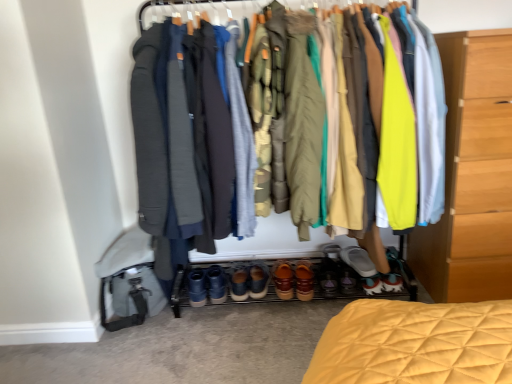
In order to face textured fabric jackets at center, should I rotate leftwards or rightwards?

It's best to rotate right around 2.307 degrees.

What is the approximate width of gray fleece robe at center, acting as the second robe starting from the left?

It is 26.82 inches.

Describe the element at coordinates (307, 278) in the screenshot. The height and width of the screenshot is (384, 512). I see `leather shoes at center, which ranks as the 4th footwear in left-to-right order` at that location.

You are a GUI agent. You are given a task and a screenshot of the screen. Output one action in this format:
    pyautogui.click(x=<x>, y=<y>)
    Task: Click on the textured fabric jackets at center
    
    Given the screenshot: What is the action you would take?
    pyautogui.click(x=267, y=242)

Is leather shoes at center, which ranks as the 4th footwear in left-to-right order, positioned with its back to leather suede shoes at center, placed as the sixth footwear when sorted from right to left?

leather shoes at center, which ranks as the 4th footwear in left-to-right order, does not have its back to leather suede shoes at center, placed as the sixth footwear when sorted from right to left.

From the image's perspective, count 2nd footwears upward from the leather shoes at center, which ranks as the 4th footwear in left-to-right order, and point to it. Please provide its 2D coordinates.

[(239, 284)]

In the scene shown: Is leather shoes at center, which ranks as the 4th footwear in left-to-right order, bigger or smaller than leather suede shoes at center, placed as the sixth footwear when sorted from right to left?

Clearly, leather shoes at center, which ranks as the 4th footwear in left-to-right order, is larger in size than leather suede shoes at center, placed as the sixth footwear when sorted from right to left.

From the picture: From the image's perspective, between leather shoes at center, which ranks as the 4th footwear in left-to-right order, and leather suede shoes at center, which appears as the 1th footwear when viewed from the left, which one is located above?

leather suede shoes at center, which appears as the 1th footwear when viewed from the left, is shown above in the image.

From the image's perspective, is olive green cotton robe at center, the fourth robe from the left, over leather shoes at center, which ranks as the 4th footwear in left-to-right order?

Indeed, from the image's perspective, olive green cotton robe at center, the fourth robe from the left, is shown above leather shoes at center, which ranks as the 4th footwear in left-to-right order.

Is olive green cotton robe at center, the fourth robe from the left, looking in the opposite direction of leather shoes at center, which ranks as the 4th footwear in left-to-right order?

No, olive green cotton robe at center, the fourth robe from the left, is not facing away from leather shoes at center, which ranks as the 4th footwear in left-to-right order.

Considering the relative sizes of olive green cotton robe at center, acting as the 1th robe starting from the right, and leather shoes at center, which ranks as the 4th footwear in left-to-right order, in the image provided, is olive green cotton robe at center, acting as the 1th robe starting from the right, smaller than leather shoes at center, which ranks as the 4th footwear in left-to-right order,?

No.

Between olive green cotton robe at center, acting as the 1th robe starting from the right, and leather shoes at center, which appears as the 3th footwear when viewed from the right, which one has more height?

With more height is olive green cotton robe at center, acting as the 1th robe starting from the right.

Where is `the 6th footwear behind the gray wool robe at center, positioned as the 3th robe in left-to-right order, counting from the anchor's position`? the 6th footwear behind the gray wool robe at center, positioned as the 3th robe in left-to-right order, counting from the anchor's position is located at coordinates (239, 284).

Does gray wool robe at center, positioned as the 3th robe in left-to-right order, have a larger size compared to leather suede shoes at center, placed as the sixth footwear when sorted from right to left?

Correct, gray wool robe at center, positioned as the 3th robe in left-to-right order, is larger in size than leather suede shoes at center, placed as the sixth footwear when sorted from right to left.

What's the angular difference between gray wool robe at center, positioned as the 3th robe in left-to-right order, and leather suede shoes at center, placed as the sixth footwear when sorted from right to left,'s facing directions?

The angular difference between gray wool robe at center, positioned as the 3th robe in left-to-right order, and leather suede shoes at center, placed as the sixth footwear when sorted from right to left, is 0.616 degrees.

Is leather suede shoes at center, placed as the sixth footwear when sorted from right to left, at the back of gray wool robe at center, positioned as the 3th robe in left-to-right order?

No, gray wool robe at center, positioned as the 3th robe in left-to-right order, is not facing away from leather suede shoes at center, placed as the sixth footwear when sorted from right to left.

Based on their sizes in the image, would you say textured fabric jackets at center is bigger or smaller than leather shoes at center, which ranks as the 4th footwear in left-to-right order?

Considering their sizes, textured fabric jackets at center takes up more space than leather shoes at center, which ranks as the 4th footwear in left-to-right order.

Is textured fabric jackets at center wider than leather shoes at center, which ranks as the 4th footwear in left-to-right order?

Correct, the width of textured fabric jackets at center exceeds that of leather shoes at center, which ranks as the 4th footwear in left-to-right order.

Is there a large distance between textured fabric jackets at center and leather shoes at center, which appears as the 3th footwear when viewed from the right?

Actually, textured fabric jackets at center and leather shoes at center, which appears as the 3th footwear when viewed from the right, are a little close together.

Is textured fabric jackets at center outside of leather shoes at center, which ranks as the 4th footwear in left-to-right order?

Yes, textured fabric jackets at center is located beyond the bounds of leather shoes at center, which ranks as the 4th footwear in left-to-right order.

Is brown suede shoes at center, placed as the 5th footwear when sorted from right to left, behind white fabric shoe at lower center, the 1th footwear viewed from the right?

Yes, it is behind white fabric shoe at lower center, the 1th footwear viewed from the right.

Is there a large distance between brown suede shoes at center, placed as the 5th footwear when sorted from right to left, and white fabric shoe at lower center, the 1th footwear viewed from the right?

Actually, brown suede shoes at center, placed as the 5th footwear when sorted from right to left, and white fabric shoe at lower center, the 1th footwear viewed from the right, are a little close together.

Who is taller, brown suede shoes at center, which appears as the second footwear when viewed from the left, or white fabric shoe at lower center, the 1th footwear viewed from the right?

brown suede shoes at center, which appears as the second footwear when viewed from the left, is taller.

Looking at the image, does brown suede shoes at center, which appears as the second footwear when viewed from the left, seem bigger or smaller compared to white fabric shoe at lower center, the 1th footwear viewed from the right?

Considering their sizes, brown suede shoes at center, which appears as the second footwear when viewed from the left, takes up more space than white fabric shoe at lower center, the 1th footwear viewed from the right.

Is leather shoes at center, which appears as the 3th footwear when viewed from the right, aimed at matte yellow jacket at right?

No, leather shoes at center, which appears as the 3th footwear when viewed from the right, is not oriented towards matte yellow jacket at right.

Where is `the 3rd footwear to the left of the matte yellow jacket at right, starting your count from the anchor`? This screenshot has height=384, width=512. the 3rd footwear to the left of the matte yellow jacket at right, starting your count from the anchor is located at coordinates (307, 278).

From a real-world perspective, between leather shoes at center, which appears as the 3th footwear when viewed from the right, and matte yellow jacket at right, who is vertically higher?

matte yellow jacket at right, from a real-world perspective.

Between leather shoes at center, which appears as the 3th footwear when viewed from the right, and dark gray fabric robe at center, the fourth robe positioned from the right, which one appears on the right side from the viewer's perspective?

Positioned to the right is leather shoes at center, which appears as the 3th footwear when viewed from the right.

Looking at their sizes, would you say leather shoes at center, which ranks as the 4th footwear in left-to-right order, is wider or thinner than dark gray fabric robe at center, the first robe in the left-to-right sequence?

leather shoes at center, which ranks as the 4th footwear in left-to-right order, is thinner than dark gray fabric robe at center, the first robe in the left-to-right sequence.

Which is behind, leather shoes at center, which ranks as the 4th footwear in left-to-right order, or dark gray fabric robe at center, the fourth robe positioned from the right?

leather shoes at center, which ranks as the 4th footwear in left-to-right order, is further from the camera.

Considering the sizes of leather shoes at center, which ranks as the 4th footwear in left-to-right order, and dark gray fabric robe at center, the fourth robe positioned from the right, in the image, is leather shoes at center, which ranks as the 4th footwear in left-to-right order, taller or shorter than dark gray fabric robe at center, the fourth robe positioned from the right,?

leather shoes at center, which ranks as the 4th footwear in left-to-right order, is shorter than dark gray fabric robe at center, the fourth robe positioned from the right.

Locate an element on the screen. the 3rd footwear to the left when counting from the leather shoes at center, which ranks as the 4th footwear in left-to-right order is located at coordinates (239, 284).

Locate an element on the screen. The image size is (512, 384). the 6th footwear directly beneath the olive green cotton robe at center, the fourth robe from the left (from a real-world perspective) is located at coordinates (307, 278).

Considering their positions, is brown leather shoes at center, which appears as the third footwear when viewed from the left, positioned closer to light wood chest of drawers at right than leather suede shoes at center, placed as the sixth footwear when sorted from right to left?

brown leather shoes at center, which appears as the third footwear when viewed from the left.

Estimate the real-world distances between objects in this image. Which object is further from leather suede shoes at center, which appears as the 1th footwear when viewed from the left, brown leather shoes at center, arranged as the 4th footwear when viewed from the right, or olive green cotton robe at center, acting as the 1th robe starting from the right?

olive green cotton robe at center, acting as the 1th robe starting from the right.

Based on the photo, based on their spatial positions, is leather brown shoes at center, the second footwear positioned from the right, or leather suede shoes at center, which appears as the 1th footwear when viewed from the left, closer to leather shoes at center, which ranks as the 4th footwear in left-to-right order?

Based on the image, leather brown shoes at center, the second footwear positioned from the right, appears to be nearer to leather shoes at center, which ranks as the 4th footwear in left-to-right order.

Looking at this image, estimate the real-world distances between objects in this image. Which object is further from olive green cotton robe at center, acting as the 1th robe starting from the right, matte yellow jacket at right or light wood chest of drawers at right?

light wood chest of drawers at right.

Considering their positions, is dark gray fabric robe at center, the first robe in the left-to-right sequence, positioned closer to leather suede shoes at center, which appears as the 1th footwear when viewed from the left, than olive green cotton robe at center, the fourth robe from the left?

Based on the image, dark gray fabric robe at center, the first robe in the left-to-right sequence, appears to be nearer to leather suede shoes at center, which appears as the 1th footwear when viewed from the left.

Looking at the image, which one is located closer to matte yellow jacket at right, light wood chest of drawers at right or textured fabric jackets at center?

Among the two, light wood chest of drawers at right is located nearer to matte yellow jacket at right.

When comparing their distances from light wood chest of drawers at right, does white fabric shoe at lower center, the 1th footwear viewed from the right, or matte yellow jacket at right seem further?

Among the two, white fabric shoe at lower center, the 1th footwear viewed from the right, is located further to light wood chest of drawers at right.

Based on their spatial positions, is matte yellow jacket at right or light wood chest of drawers at right closer to gray fleece robe at center, placed as the 3th robe when sorted from right to left?

Among the two, matte yellow jacket at right is located nearer to gray fleece robe at center, placed as the 3th robe when sorted from right to left.

The width and height of the screenshot is (512, 384). I want to click on closet that lies between gray fleece robe at center, placed as the 3th robe when sorted from right to left, and leather shoes at center, which ranks as the 4th footwear in left-to-right order, from top to bottom, so click(267, 242).

The height and width of the screenshot is (384, 512). Identify the location of closet between gray fleece robe at center, acting as the second robe starting from the left, and leather brown shoes at center, the second footwear positioned from the right, in the vertical direction. (267, 242).

The width and height of the screenshot is (512, 384). What are the coordinates of `chest of drawers between matte yellow jacket at right and leather shoes at center, which ranks as the 4th footwear in left-to-right order, from top to bottom` in the screenshot? It's located at (472, 174).

Identify the location of closet between gray fleece robe at center, placed as the 3th robe when sorted from right to left, and matte yellow jacket at right, in the horizontal direction. Image resolution: width=512 pixels, height=384 pixels. (267, 242).